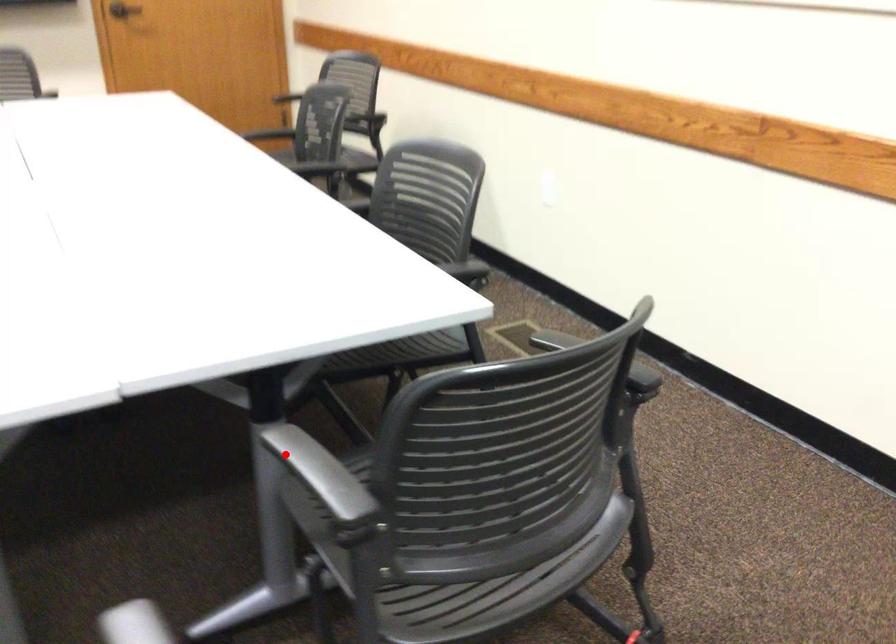
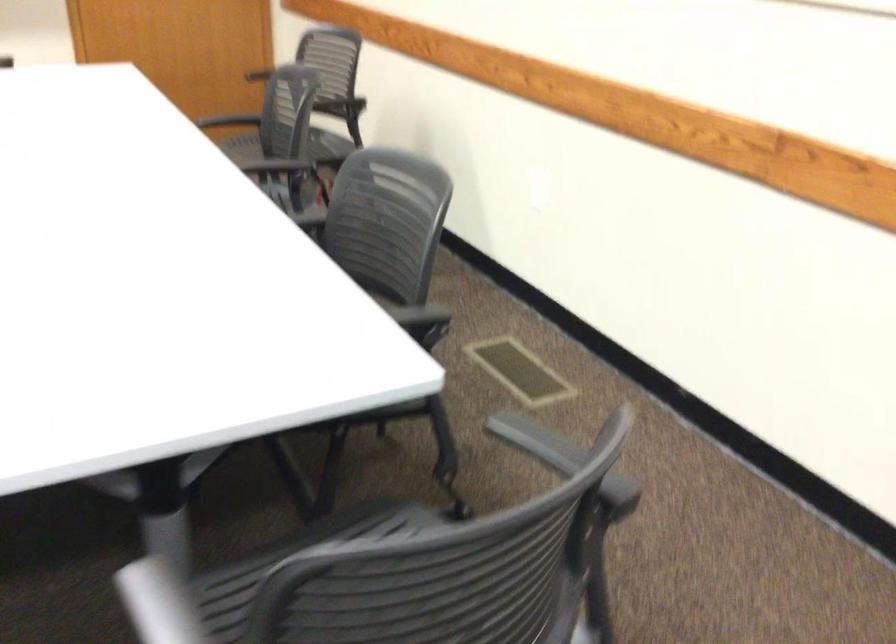
Find the pixel in the second image that matches the highlighted location in the first image.

(158, 603)